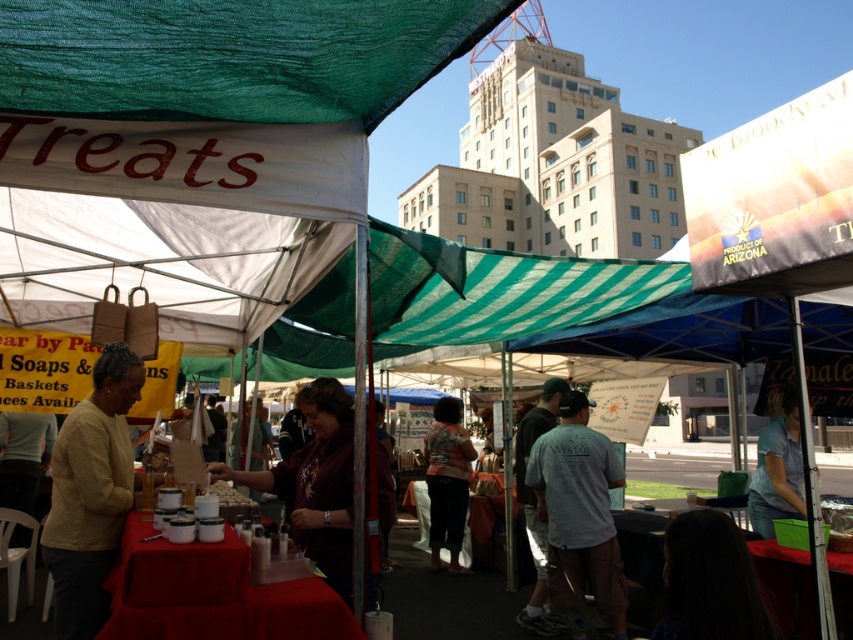
You are standing at the center of the market and see the yellow knitted sweater at left. Where is it located relative to your position?

The yellow knitted sweater at left is located at coordinates approximately 0.772 on the x axis and 0.108 on the y axis relative to your position.

You are a customer at the market stall and want to buy both the yellow knitted sweater at left and the light gray cotton shirt at center. However, you have a small bag that can only hold one item at a time. Based on their positions, which item should you pick up first to avoid knocking over the other?

The yellow knitted sweater at left is positioned over the light gray cotton shirt at center. Therefore, you should pick up the yellow knitted sweater at left first to avoid knocking over the light gray cotton shirt at center when reaching for it.